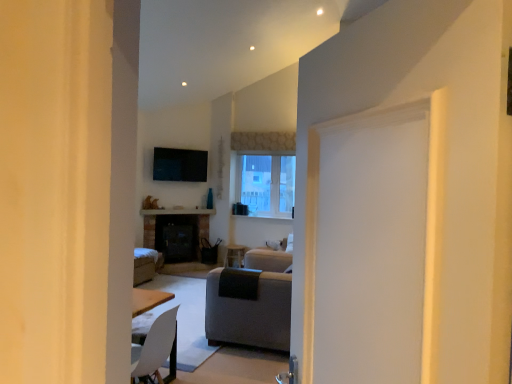
This screenshot has width=512, height=384. Identify the location of gray fabric couch at center. (248, 308).

Describe the element at coordinates (248, 308) in the screenshot. I see `gray fabric couch at center` at that location.

Measure the distance between gray fabric couch at center and camera.

A distance of 3.61 meters exists between gray fabric couch at center and camera.

What is the approximate width of clear glass window at center?

9.55 inches.

Image resolution: width=512 pixels, height=384 pixels. What do you see at coordinates (266, 184) in the screenshot?
I see `clear glass window at center` at bounding box center [266, 184].

You are a GUI agent. You are given a task and a screenshot of the screen. Output one action in this format:
    pyautogui.click(x=<x>, y=<y>)
    Task: Click on the clear glass window at center
    The height and width of the screenshot is (384, 512).
    Given the screenshot: What is the action you would take?
    pyautogui.click(x=266, y=184)

You are a GUI agent. You are given a task and a screenshot of the screen. Output one action in this format:
    pyautogui.click(x=<x>, y=<y>)
    Task: Click on the gray fabric couch at center
    Image resolution: width=512 pixels, height=384 pixels.
    Given the screenshot: What is the action you would take?
    pyautogui.click(x=248, y=308)

Considering the relative positions of gray fabric couch at center and clear glass window at center in the image provided, is gray fabric couch at center to the left or to the right of clear glass window at center?

In the image, gray fabric couch at center appears on the left side of clear glass window at center.

Which is behind, gray fabric couch at center or clear glass window at center?

clear glass window at center is further away from the camera.

Is point (261, 310) more distant than point (241, 158)?

No, (261, 310) is closer to viewer.

From the image's perspective, relative to clear glass window at center, is gray fabric couch at center above or below?

Clearly, from the image's perspective, gray fabric couch at center is below clear glass window at center.

From a real-world perspective, which is physically below, gray fabric couch at center or clear glass window at center?

In real-world perspective, gray fabric couch at center is lower.

Considering the sizes of objects gray fabric couch at center and clear glass window at center in the image provided, who is wider, gray fabric couch at center or clear glass window at center?

Wider between the two is gray fabric couch at center.

Can you confirm if gray fabric couch at center is shorter than clear glass window at center?

Yes, gray fabric couch at center is shorter than clear glass window at center.

Is gray fabric couch at center smaller than clear glass window at center?

No.

Can we say gray fabric couch at center lies outside clear glass window at center?

gray fabric couch at center lies outside clear glass window at center's area.

Are gray fabric couch at center and clear glass window at center located far from each other?

Yes, gray fabric couch at center and clear glass window at center are located far from each other.

In the scene shown: Is clear glass window at center at the back of gray fabric couch at center?

No.

Can you tell me how much gray fabric couch at center and clear glass window at center differ in facing direction?

The angular difference between gray fabric couch at center and clear glass window at center is 88.1 degrees.

You are a GUI agent. You are given a task and a screenshot of the screen. Output one action in this format:
    pyautogui.click(x=<x>, y=<y>)
    Task: Click on the studio couch below the clear glass window at center (from the image's perspective)
    The width and height of the screenshot is (512, 384).
    Given the screenshot: What is the action you would take?
    pyautogui.click(x=248, y=308)

Considering the positions of objects clear glass window at center and gray fabric couch at center in the image provided, who is more to the left, clear glass window at center or gray fabric couch at center?

Positioned to the left is gray fabric couch at center.

Between clear glass window at center and gray fabric couch at center, which one is positioned in front?

gray fabric couch at center is more forward.

Does point (284, 161) come farther from viewer compared to point (261, 291)?

Yes, it is.

From the image's perspective, is clear glass window at center located beneath gray fabric couch at center?

No.

From a real-world perspective, is clear glass window at center beneath gray fabric couch at center?

No, from a real-world perspective, clear glass window at center is not under gray fabric couch at center.

In terms of width, does clear glass window at center look wider or thinner when compared to gray fabric couch at center?

clear glass window at center is thinner than gray fabric couch at center.

Considering the sizes of objects clear glass window at center and gray fabric couch at center in the image provided, who is taller, clear glass window at center or gray fabric couch at center?

Standing taller between the two is clear glass window at center.

Is clear glass window at center bigger than gray fabric couch at center?

Incorrect, clear glass window at center is not larger than gray fabric couch at center.

Is clear glass window at center inside the boundaries of gray fabric couch at center, or outside?

clear glass window at center is spatially situated outside gray fabric couch at center.

Is clear glass window at center touching gray fabric couch at center?

No.

Is clear glass window at center positioned with its back to gray fabric couch at center?

No, clear glass window at center is not facing the opposite direction of gray fabric couch at center.

Where is `studio couch below the clear glass window at center (from the image's perspective)`? studio couch below the clear glass window at center (from the image's perspective) is located at coordinates (248, 308).

Where is `window lying on the right of gray fabric couch at center`? This screenshot has height=384, width=512. window lying on the right of gray fabric couch at center is located at coordinates (266, 184).

Identify the location of studio couch below the clear glass window at center (from a real-world perspective). The height and width of the screenshot is (384, 512). (248, 308).